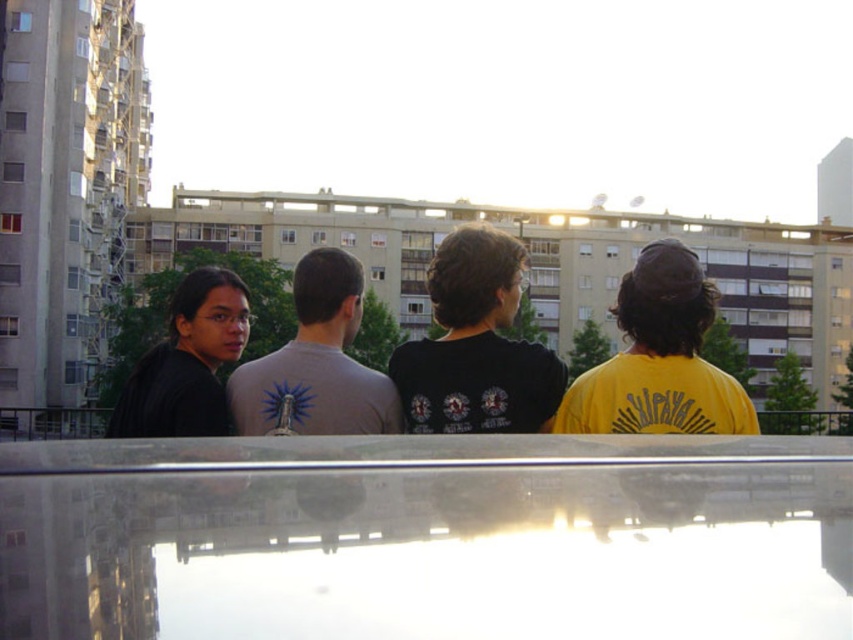
Question: Is yellow matte shirt at upper right thinner than black matte shirt at left?

Choices:
 (A) no
 (B) yes

Answer: (B)

Question: Is black matte t-shirt at center to the left of gray matte t-shirt at center from the viewer's perspective?

Choices:
 (A) no
 (B) yes

Answer: (A)

Question: Which object is positioned closest to the black matte t-shirt at center?

Choices:
 (A) yellow matte shirt at upper right
 (B) black matte shirt at left
 (C) gray matte t-shirt at center

Answer: (C)

Question: Does gray matte t-shirt at center have a smaller size compared to black matte shirt at left?

Choices:
 (A) no
 (B) yes

Answer: (B)

Question: Among these points, which one is farthest from the camera?

Choices:
 (A) (315, 356)
 (B) (231, 323)
 (C) (527, 417)
 (D) (647, 413)

Answer: (B)

Question: Which of the following is the closest to the observer?

Choices:
 (A) yellow matte shirt at upper right
 (B) black matte shirt at left

Answer: (A)